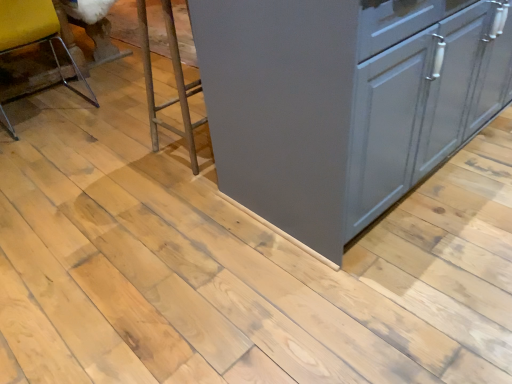
Question: Is clear plastic chair at left not close to satin gray cabinet at center?

Choices:
 (A) no
 (B) yes

Answer: (B)

Question: Can you confirm if clear plastic chair at left is wider than satin gray cabinet at center?

Choices:
 (A) no
 (B) yes

Answer: (A)

Question: Is clear plastic chair at left outside of satin gray cabinet at center?

Choices:
 (A) no
 (B) yes

Answer: (B)

Question: From a real-world perspective, is clear plastic chair at left below satin gray cabinet at center?

Choices:
 (A) no
 (B) yes

Answer: (B)

Question: Considering the relative positions of clear plastic chair at left and satin gray cabinet at center in the image provided, is clear plastic chair at left to the right of satin gray cabinet at center from the viewer's perspective?

Choices:
 (A) no
 (B) yes

Answer: (A)

Question: Considering the relative sizes of clear plastic chair at left and satin gray cabinet at center in the image provided, is clear plastic chair at left smaller than satin gray cabinet at center?

Choices:
 (A) no
 (B) yes

Answer: (B)

Question: Can you confirm if satin gray cabinet at center is smaller than clear plastic chair at left?

Choices:
 (A) yes
 (B) no

Answer: (B)

Question: From a real-world perspective, is satin gray cabinet at center on top of clear plastic chair at left?

Choices:
 (A) no
 (B) yes

Answer: (B)

Question: Is satin gray cabinet at center closer to camera compared to clear plastic chair at left?

Choices:
 (A) yes
 (B) no

Answer: (A)

Question: Can we say satin gray cabinet at center lies outside clear plastic chair at left?

Choices:
 (A) yes
 (B) no

Answer: (A)

Question: Is satin gray cabinet at center aimed at clear plastic chair at left?

Choices:
 (A) yes
 (B) no

Answer: (A)

Question: Is the depth of satin gray cabinet at center greater than that of clear plastic chair at left?

Choices:
 (A) no
 (B) yes

Answer: (A)

Question: Is clear plastic chair at left at the right side of metallic silver step stool at center?

Choices:
 (A) yes
 (B) no

Answer: (B)